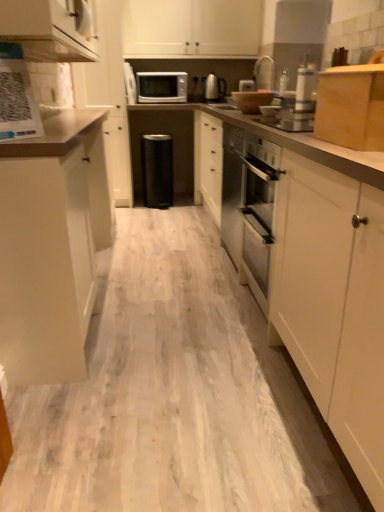
Identify the location of free point in front of black matte dishwasher at center. (165, 210).